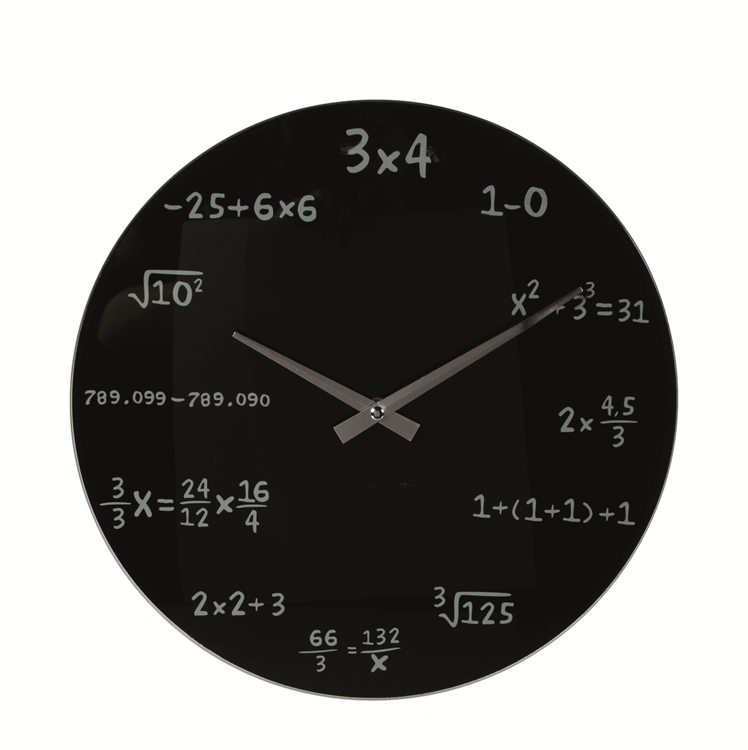
Locate an element on the screen. The width and height of the screenshot is (748, 750). face of clock is located at coordinates (434, 538).